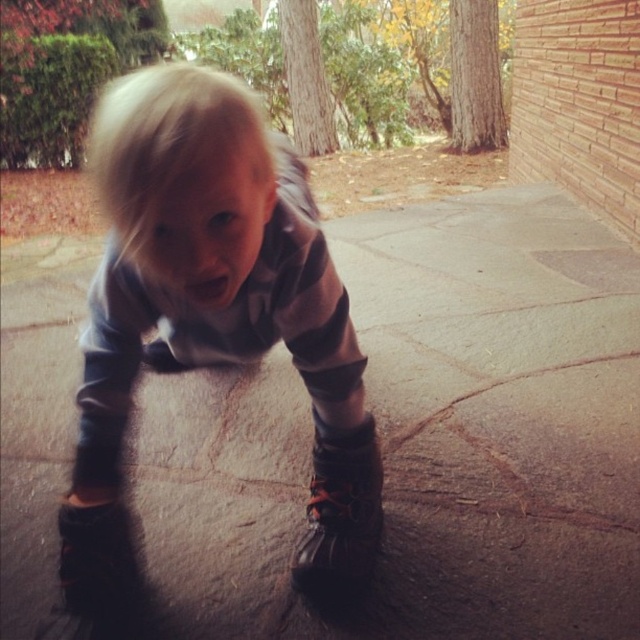
You are a parent trying to dress your child properly for an outdoor activity. You have a gray fleece hoodie at center and a leather boot at lower left. Considering their current positions, will the child be able to put on both items without moving either the hoodie or the boot?

The gray fleece hoodie at center and leather boot at lower left are 8.15 inches apart from each other. Since the distance between them is sufficient for the child to access both items, the child can put on both the gray fleece hoodie at center and the leather boot at lower left without moving either item.

The child is trying to put on their boots. They have two boots to choose from. Which boot, the black leather boot at lower center or the leather boot at lower left, would require the child to bend their legs more due to its height?

The black leather boot at lower center is much taller as leather boot at lower left, so the child would need to bend their legs more when putting on the black leather boot at lower center.